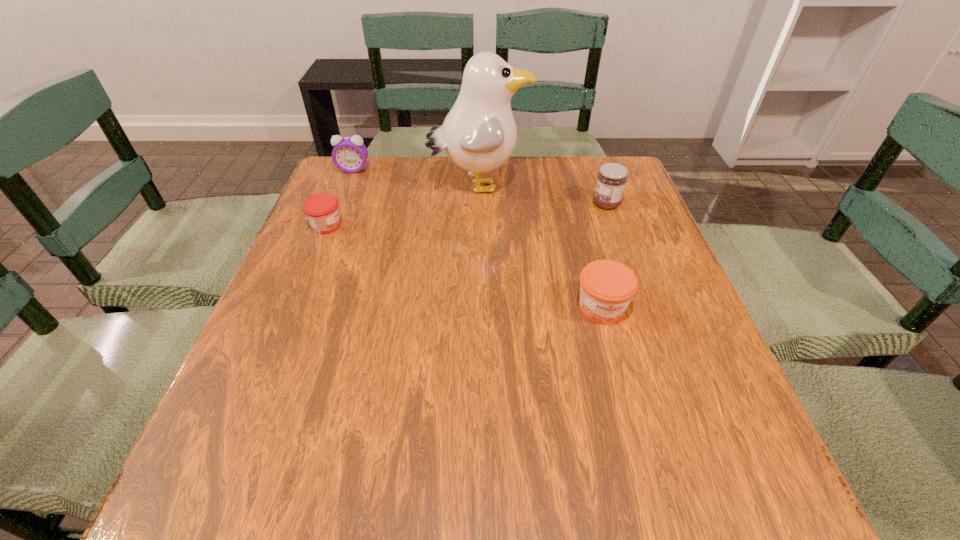
Locate an element on the screen. This screenshot has height=540, width=960. the tallest object is located at coordinates (479, 134).

Find the location of a particular element. the third object from right to left is located at coordinates (479, 134).

You are a GUI agent. You are given a task and a screenshot of the screen. Output one action in this format:
    pyautogui.click(x=<x>, y=<y>)
    Task: Click on the alarm clock
    The image size is (960, 540).
    Given the screenshot: What is the action you would take?
    pyautogui.click(x=350, y=154)

Where is `the farthest jam`? the farthest jam is located at coordinates [611, 180].

Find the location of a particular element. the nearest jam is located at coordinates (607, 287).

Image resolution: width=960 pixels, height=540 pixels. I want to click on the shortest object, so click(x=322, y=210).

The height and width of the screenshot is (540, 960). What are the coordinates of `the leftmost jam` in the screenshot? It's located at (322, 210).

Identify the location of free space located on the beak of the gull. The height and width of the screenshot is (540, 960). coord(602,186).

Identify the location of vacant space positioned on the face of the alarm clock. Image resolution: width=960 pixels, height=540 pixels. (341, 202).

The width and height of the screenshot is (960, 540). What are the coordinates of `blank space located 0.370m on the front label of the farthest jam` in the screenshot? It's located at (449, 204).